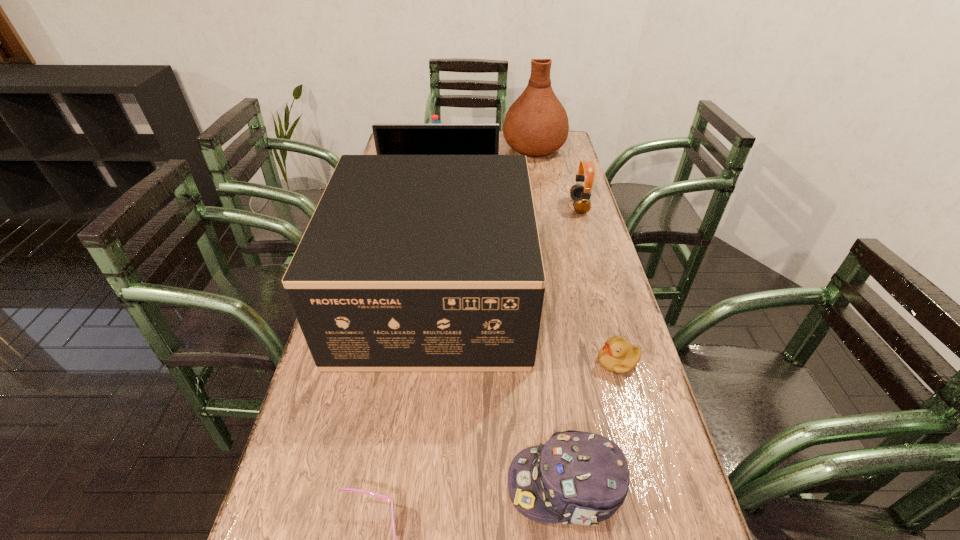
Find the location of a particular element. The width and height of the screenshot is (960, 540). pitcher is located at coordinates pyautogui.click(x=536, y=124).

The height and width of the screenshot is (540, 960). I want to click on box, so click(410, 263).

Identify the location of monitor. This screenshot has height=540, width=960. (390, 139).

The image size is (960, 540). I want to click on water bottle, so click(x=434, y=118).

Where is `the fifth tallest object`? The height and width of the screenshot is (540, 960). the fifth tallest object is located at coordinates (580, 194).

This screenshot has height=540, width=960. In order to click on headwear in this screenshot , I will do point(576,477).

The width and height of the screenshot is (960, 540). I want to click on the seventh tallest object, so click(x=617, y=356).

Locate an element on the screen. The width and height of the screenshot is (960, 540). vacant space positioned 0.170m on the front-facing side of the box is located at coordinates (588, 295).

Locate an element on the screen. The width and height of the screenshot is (960, 540). free space located on the screen side of the monitor is located at coordinates (436, 247).

Find the location of a particular element. vacant area situated on the front label of the water bottle is located at coordinates (509, 163).